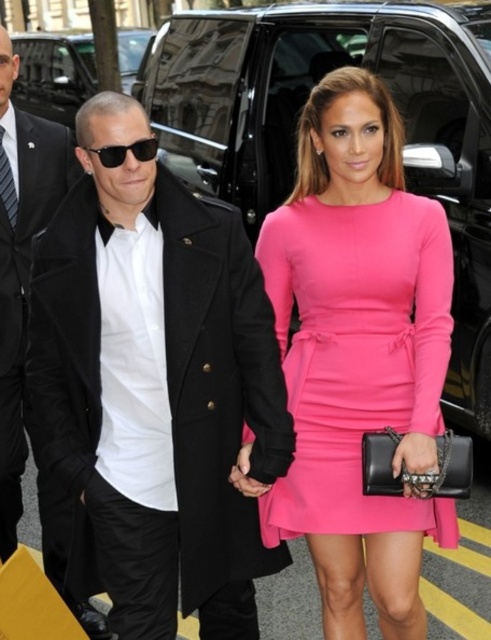
Is matte pink dress at center smaller than black wool coat at left?

Correct, matte pink dress at center occupies less space than black wool coat at left.

Who is taller, matte pink dress at center or black wool coat at left?

black wool coat at left is taller.

Who is more forward, [349,340] or [9,464]?

Point [349,340]

I want to click on matte pink dress at center, so click(x=356, y=356).

The height and width of the screenshot is (640, 491). Identify the location of black wool coat at center. (156, 385).

Can you confirm if black wool coat at center is smaller than matte pink dress at center?

No.

Who is more forward, [205,477] or [282,536]?

Positioned in front is point [205,477].

Where is `black wool coat at center`? black wool coat at center is located at coordinates (156, 385).

Is black wool coat at center smaller than black wool coat at left?

No.

Between black wool coat at center and black wool coat at left, which one appears on the left side from the viewer's perspective?

black wool coat at left

Image resolution: width=491 pixels, height=640 pixels. In order to click on black wool coat at center in this screenshot , I will do `click(156, 385)`.

Identify the location of black wool coat at center. tap(156, 385).